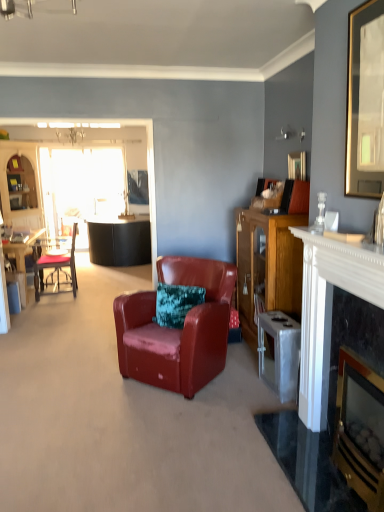
You are a GUI agent. You are given a task and a screenshot of the screen. Output one action in this format:
    pyautogui.click(x=<x>, y=<y>)
    Task: Click on the gold-framed picture at upper right, arranged as the first picture frame when viewed from the front
    The width and height of the screenshot is (384, 512).
    Given the screenshot: What is the action you would take?
    pyautogui.click(x=365, y=101)

In order to click on wooden cabinet at right in this screenshot , I will do `click(268, 264)`.

Where is `black leather sofa at left, arranged as the second entertainment center when viewed from the back`? The image size is (384, 512). black leather sofa at left, arranged as the second entertainment center when viewed from the back is located at coordinates (59, 183).

Measure the distance between leather armchair at center, the first chair viewed from the front, and camera.

leather armchair at center, the first chair viewed from the front, is 9.05 feet away from camera.

This screenshot has width=384, height=512. What do you see at coordinates (177, 329) in the screenshot? I see `leather armchair at center, which is the 2th chair in left-to-right order` at bounding box center [177, 329].

Locate an element on the screen. This screenshot has height=512, width=384. gold-framed picture at upper right, arranged as the first picture frame when viewed from the front is located at coordinates click(365, 101).

Where is `the 1st chair counting from the left side of the gold-framed picture at upper right, which is counted as the first picture frame, starting from the back`? The width and height of the screenshot is (384, 512). the 1st chair counting from the left side of the gold-framed picture at upper right, which is counted as the first picture frame, starting from the back is located at coordinates (177, 329).

Between leather armchair at center, which is the 2th chair in left-to-right order, and gold-framed picture at upper right, the 2th picture frame when ordered from front to back, which one appears on the left side from the viewer's perspective?

From the viewer's perspective, leather armchair at center, which is the 2th chair in left-to-right order, appears more on the left side.

From the image's perspective, does leather armchair at center, which is the 2th chair in left-to-right order, appear higher than gold-framed picture at upper right, the 2th picture frame when ordered from front to back?

No, from the image's perspective, leather armchair at center, which is the 2th chair in left-to-right order, is not above gold-framed picture at upper right, the 2th picture frame when ordered from front to back.

Is point (209, 332) farther from camera compared to point (290, 161)?

No, it is not.

Is marble fireplace at right, arranged as the 1th fireplace when viewed from the left, to the right of leather armchair at center, acting as the 1th chair starting from the right, from the viewer's perspective?

Indeed, marble fireplace at right, arranged as the 1th fireplace when viewed from the left, is positioned on the right side of leather armchair at center, acting as the 1th chair starting from the right.

Looking at their sizes, would you say marble fireplace at right, arranged as the 1th fireplace when viewed from the left, is wider or thinner than leather armchair at center, positioned as the second chair in back-to-front order?

Considering their sizes, marble fireplace at right, arranged as the 1th fireplace when viewed from the left, looks slimmer than leather armchair at center, positioned as the second chair in back-to-front order.

Who is bigger, marble fireplace at right, arranged as the 1th fireplace when viewed from the left, or leather armchair at center, acting as the 1th chair starting from the right?

Bigger between the two is leather armchair at center, acting as the 1th chair starting from the right.

From a real-world perspective, is gold-framed picture at upper right, arranged as the first picture frame when viewed from the front, above or below black leather sofa at left, arranged as the second entertainment center when viewed from the back?

gold-framed picture at upper right, arranged as the first picture frame when viewed from the front, is situated higher than black leather sofa at left, arranged as the second entertainment center when viewed from the back, in the real world.

Can you tell me how much gold-framed picture at upper right, arranged as the first picture frame when viewed from the front, and black leather sofa at left, placed as the 1th entertainment center when sorted from front to back, differ in facing direction?

89.7 degrees.

From a real-world perspective, count 2nd entertainment centers downward from the gold-framed picture at upper right, which ranks as the 2th picture frame in back-to-front order, and point to it. Please provide its 2D coordinates.

[(59, 183)]

Can you confirm if gold-framed picture at upper right, which ranks as the 2th picture frame in back-to-front order, is wider than black leather sofa at left, positioned as the 2th entertainment center in left-to-right order?

No, gold-framed picture at upper right, which ranks as the 2th picture frame in back-to-front order, is not wider than black leather sofa at left, positioned as the 2th entertainment center in left-to-right order.

Which object is wider, matte brown desk at left or transparent glass door at left?

matte brown desk at left.

Between matte brown desk at left and transparent glass door at left, which one appears on the right side from the viewer's perspective?

transparent glass door at left is more to the right.

Does matte brown desk at left contain transparent glass door at left?

No.

How different are the orientations of matte brown desk at left and transparent glass door at left in degrees?

89.8 degrees.

Is black leather sofa at left, positioned as the 2th entertainment center in left-to-right order, taller or shorter than black marble fireplace at right, the first fireplace from the right?

In the image, black leather sofa at left, positioned as the 2th entertainment center in left-to-right order, appears to be taller than black marble fireplace at right, the first fireplace from the right.

Is black leather sofa at left, which appears as the first entertainment center when viewed from the right, situated inside black marble fireplace at right, which is counted as the 2th fireplace, starting from the left, or outside?

black leather sofa at left, which appears as the first entertainment center when viewed from the right, is located beyond the bounds of black marble fireplace at right, which is counted as the 2th fireplace, starting from the left.

Which is closer, [89,127] or [381,492]?

Point [89,127] is farther from the camera than point [381,492].

Is black leather sofa at left, arranged as the second entertainment center when viewed from the back, further to camera compared to black marble fireplace at right, the first fireplace from the right?

Yes, it is.

Is matte brown desk at left not within black leather sofa at left, which appears as the first entertainment center when viewed from the right?

Yes, matte brown desk at left is not within black leather sofa at left, which appears as the first entertainment center when viewed from the right.

Considering the sizes of objects matte brown desk at left and black leather sofa at left, which appears as the first entertainment center when viewed from the right, in the image provided, who is bigger, matte brown desk at left or black leather sofa at left, which appears as the first entertainment center when viewed from the right,?

matte brown desk at left.

From a real-world perspective, is matte brown desk at left beneath black leather sofa at left, placed as the 1th entertainment center when sorted from front to back?

Yes.

Which is closer to the camera, (x=30, y=237) or (x=3, y=193)?

Point (x=30, y=237)

From the image's perspective, is gold-framed picture at upper right, the 2th picture frame when ordered from front to back, above or below marble fireplace at right, which is counted as the second fireplace, starting from the right?

gold-framed picture at upper right, the 2th picture frame when ordered from front to back, is above marble fireplace at right, which is counted as the second fireplace, starting from the right.

Can you see gold-framed picture at upper right, the 2th picture frame when ordered from front to back, touching marble fireplace at right, which is counted as the second fireplace, starting from the right?

No, gold-framed picture at upper right, the 2th picture frame when ordered from front to back, is not in contact with marble fireplace at right, which is counted as the second fireplace, starting from the right.

Between point (296, 157) and point (317, 347), which one is positioned in front?

Positioned in front is point (317, 347).

Consider the image. Measure the distance between gold-framed picture at upper right, the 2th picture frame when ordered from front to back, and marble fireplace at right, arranged as the 1th fireplace when viewed from the left.

The distance of gold-framed picture at upper right, the 2th picture frame when ordered from front to back, from marble fireplace at right, arranged as the 1th fireplace when viewed from the left, is 4.36 feet.

From the image's perspective, starting from the leather armchair at center, the first chair viewed from the front, which picture frame is the 2nd one above? Please provide its 2D coordinates.

[(297, 165)]

Image resolution: width=384 pixels, height=512 pixels. I want to click on the 1st fireplace to the right when counting from the leather armchair at center, acting as the 1th chair starting from the right, so click(325, 301).

Estimate the real-world distances between objects in this image. Which object is further from black leather sofa at left, arranged as the second entertainment center when viewed from the back, black marble fireplace at right, the first fireplace from the right, or metallic silver trash can at right?

black marble fireplace at right, the first fireplace from the right, is further to black leather sofa at left, arranged as the second entertainment center when viewed from the back.

From the image, which object appears to be nearer to gold-framed picture at upper right, the 2th picture frame when ordered from front to back, leather armchair at center, acting as the 1th chair starting from the right, or wooden cabinet at left, which ranks as the 1th entertainment center in back-to-front order?

The object closer to gold-framed picture at upper right, the 2th picture frame when ordered from front to back, is leather armchair at center, acting as the 1th chair starting from the right.

From the image, which object appears to be nearer to metallic silver trash can at right, gold-framed picture at upper right, which ranks as the 2th picture frame in back-to-front order, or matte brown desk at left?

gold-framed picture at upper right, which ranks as the 2th picture frame in back-to-front order, is positioned closer to the anchor metallic silver trash can at right.

Estimate the real-world distances between objects in this image. Which object is further from marble fireplace at right, arranged as the 1th fireplace when viewed from the left, metallic silver trash can at right or black marble fireplace at right, the first fireplace from the right?

metallic silver trash can at right.

From the image, which object appears to be nearer to marble fireplace at right, arranged as the 1th fireplace when viewed from the left, wooden cabinet at right or transparent glass door at left?

wooden cabinet at right.

Estimate the real-world distances between objects in this image. Which object is closer to black leather sofa at left, placed as the 1th entertainment center when sorted from front to back, gold-framed picture at upper right, which ranks as the 2th picture frame in back-to-front order, or transparent glass door at left?

transparent glass door at left is positioned closer to the anchor black leather sofa at left, placed as the 1th entertainment center when sorted from front to back.

When comparing their distances from marble fireplace at right, arranged as the 1th fireplace when viewed from the left, does transparent glass door at left or wooden cabinet at right seem closer?

wooden cabinet at right is positioned closer to the anchor marble fireplace at right, arranged as the 1th fireplace when viewed from the left.

Which object lies nearer to the anchor point wooden cabinet at left, which is the 2th entertainment center in front-to-back order, black leather sofa at left, placed as the 1th entertainment center when sorted from front to back, or gold-framed picture at upper right, the 2th picture frame when ordered from front to back?

The object closer to wooden cabinet at left, which is the 2th entertainment center in front-to-back order, is black leather sofa at left, placed as the 1th entertainment center when sorted from front to back.

Locate an element on the screen. The width and height of the screenshot is (384, 512). appliance situated between leather armchair at center, acting as the 1th chair starting from the right, and wooden cabinet at right from left to right is located at coordinates (280, 353).

Locate an element on the screen. appliance between matte brown desk at left and gold-framed picture at upper right, arranged as the first picture frame when viewed from the front, in the horizontal direction is located at coordinates (280, 353).

Image resolution: width=384 pixels, height=512 pixels. Identify the location of cabinetry that lies between gold-framed picture at upper right, which is counted as the first picture frame, starting from the back, and metallic silver trash can at right from top to bottom. (268, 264).

This screenshot has width=384, height=512. I want to click on entertainment center between marble fireplace at right, which is counted as the second fireplace, starting from the right, and matte brown desk at left, along the z-axis, so click(59, 183).